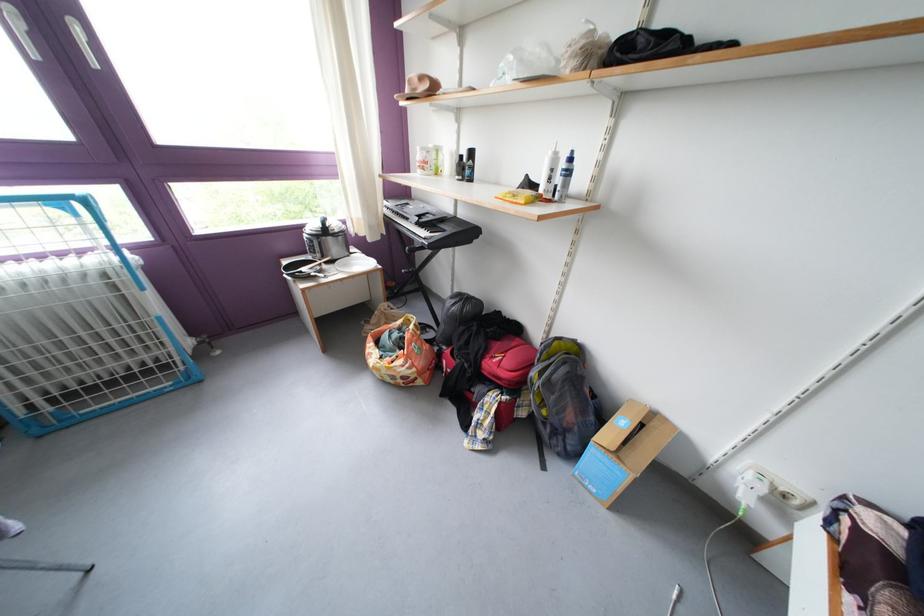
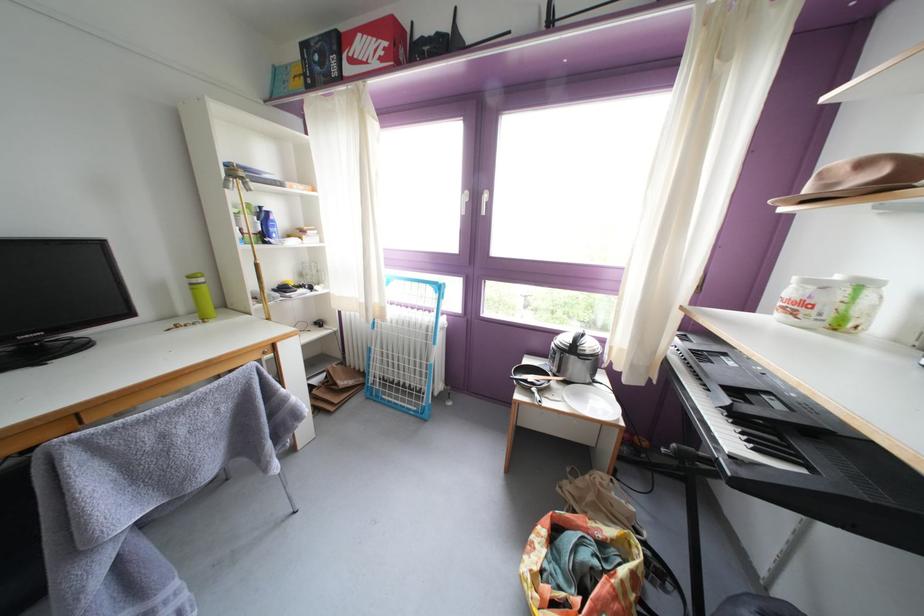
Question: The camera is either moving clockwise (left) or counter-clockwise (right) around the object. The first image is from the beginning of the video and the second image is from the end. Is the camera moving left or right when shooting the video?

Choices:
 (A) Left
 (B) Right

Answer: (B)